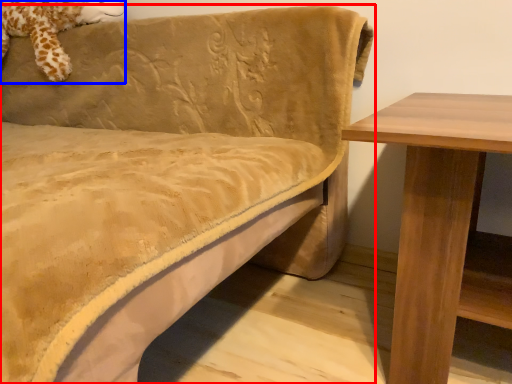
Question: Which of the following is the closest to the observer, studio couch (highlighted by a red box) or animal (highlighted by a blue box)?

Choices:
 (A) studio couch
 (B) animal

Answer: (A)